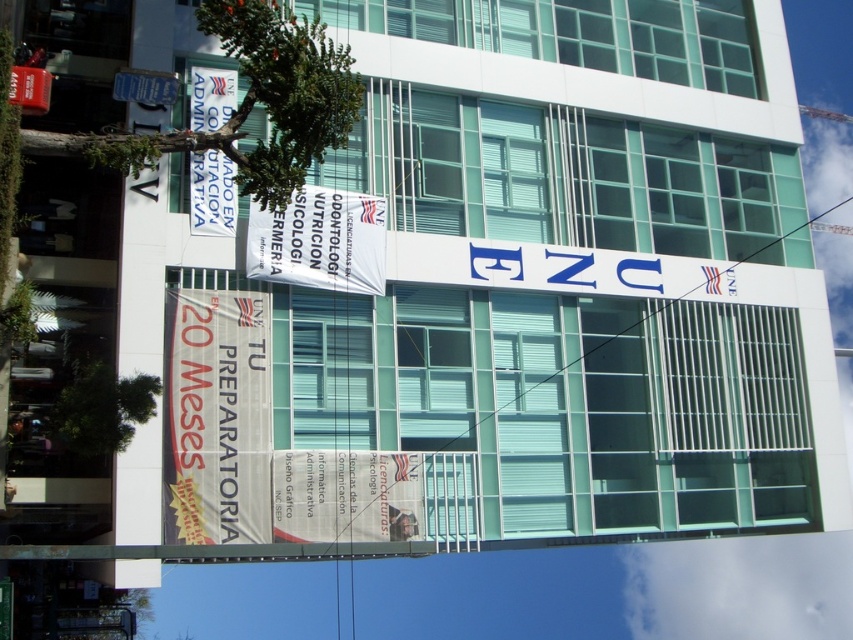
Question: From the image, what is the correct spatial relationship of white paper banner at center in relation to white paper banner at upper left?

Choices:
 (A) below
 (B) above

Answer: (A)

Question: Does red banner at lower left appear under white paper banner at upper left?

Choices:
 (A) no
 (B) yes

Answer: (B)

Question: Is white fabric banner at center wider than white paper banner at upper left?

Choices:
 (A) yes
 (B) no

Answer: (A)

Question: Which object appears farthest from the camera in this image?

Choices:
 (A) red banner at lower left
 (B) white fabric banner at center
 (C) white paper banner at center
 (D) white paper banner at upper left

Answer: (B)

Question: Which of the following is the closest to the observer?

Choices:
 (A) (343, 276)
 (B) (401, 470)
 (C) (167, 497)
 (D) (213, 96)

Answer: (C)

Question: Which point is farther to the camera?

Choices:
 (A) (236, 396)
 (B) (328, 532)
 (C) (219, 212)

Answer: (C)